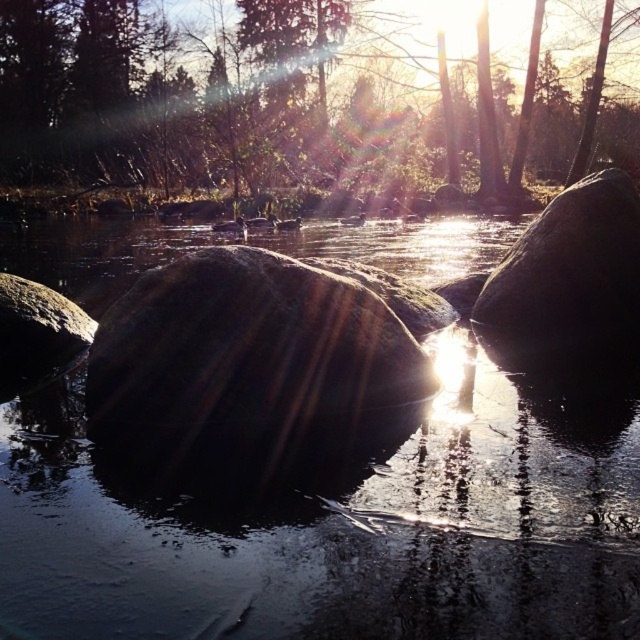
I want to click on glossy rock at center, so click(x=342, y=525).

Can you confirm if smooth rock at center is positioned to the right of smooth gray rock at left?

Correct, you'll find smooth rock at center to the right of smooth gray rock at left.

Is smooth rock at center shorter than smooth gray rock at left?

In fact, smooth rock at center may be taller than smooth gray rock at left.

You are a GUI agent. You are given a task and a screenshot of the screen. Output one action in this format:
    pyautogui.click(x=<x>, y=<y>)
    Task: Click on the smooth rock at center
    The image size is (640, 640).
    Given the screenshot: What is the action you would take?
    pyautogui.click(x=248, y=353)

The image size is (640, 640). What are the coordinates of `smooth rock at center` in the screenshot? It's located at (248, 353).

Between point (422, 563) and point (480, 29), which one is positioned behind?

Point (480, 29)

Is glossy rock at center closer to camera compared to green matte tree at upper center?

Yes, glossy rock at center is closer to the viewer.

Where is `glossy rock at center`? This screenshot has height=640, width=640. glossy rock at center is located at coordinates (342, 525).